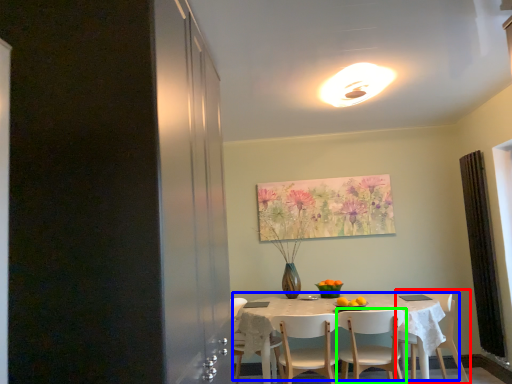
Question: Which object is positioned closest to chair (highlighted by a red box)? Select from kitchen & dining room table (highlighted by a blue box) and chair (highlighted by a green box).

Choices:
 (A) kitchen & dining room table
 (B) chair

Answer: (B)